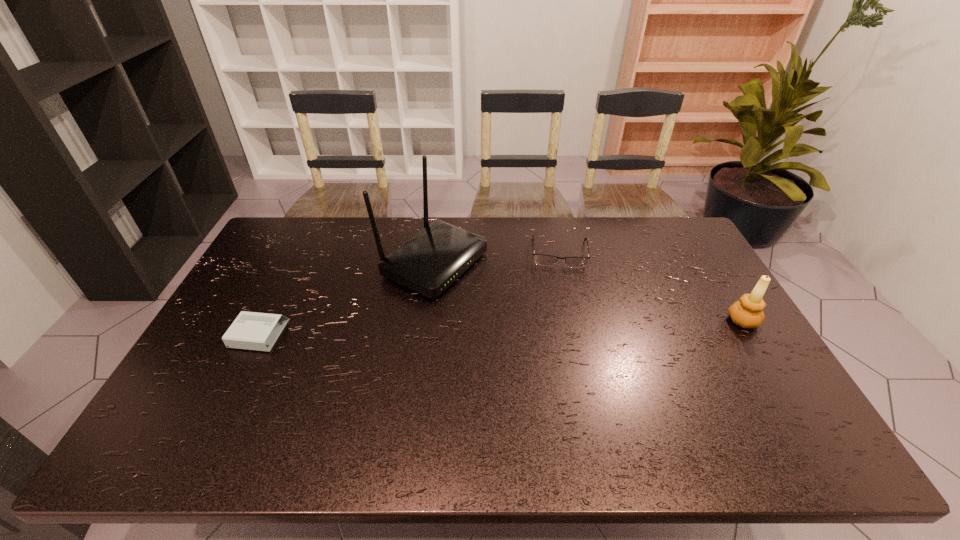
This screenshot has height=540, width=960. Find the location of `free spot on the desktop that is between the leftmost object and the rightmost object and is positioned on the front-facing side of the router`. free spot on the desktop that is between the leftmost object and the rightmost object and is positioned on the front-facing side of the router is located at coordinates (574, 325).

Locate an element on the screen. The width and height of the screenshot is (960, 540). vacant spot on the desktop that is between the leftmost object and the candle_holder and is positioned on the front-facing side of the third object from left to right is located at coordinates (564, 326).